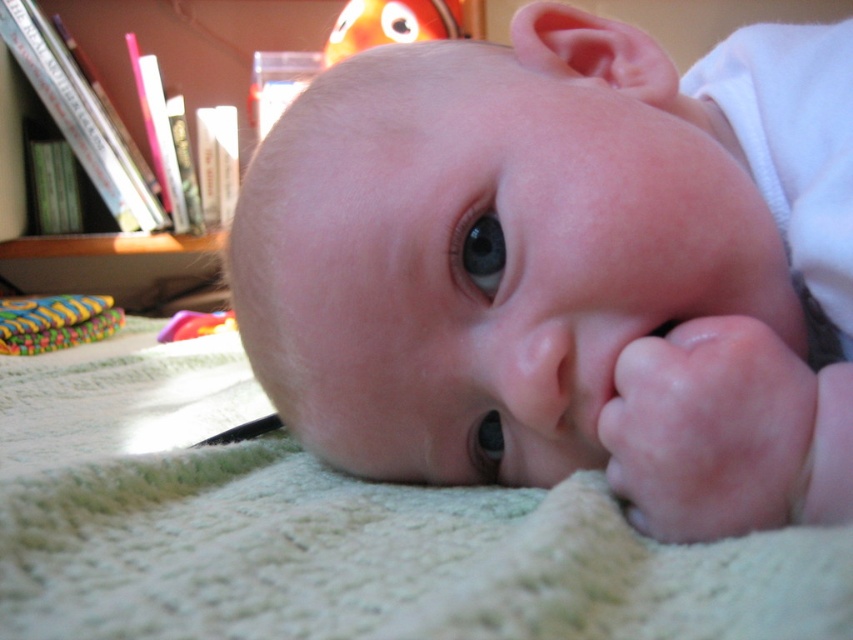
Based on the scene description, can you determine the spatial relationship between the white knitted blanket at center and the rubberized plastic toy at lower left?

The white knitted blanket at center is to the right of the rubberized plastic toy at lower left.

You are a parent trying to clean up the baby play area. You see the white knitted blanket at center and the rubberized plastic toy at lower left. Which object should you pick up first to avoid covering the baby?

You should pick up the rubberized plastic toy at lower left first because the white knitted blanket at center is located below it, so lifting the toy first will prevent the blanket from being covered.

Consider the image. You are a photographer setting up a shoot for a baby photo session. You have a white knitted blanket at center and an orange plush toy at upper center in the scene. Which object is taller in the image?

The orange plush toy at upper center is taller than the white knitted blanket at center.